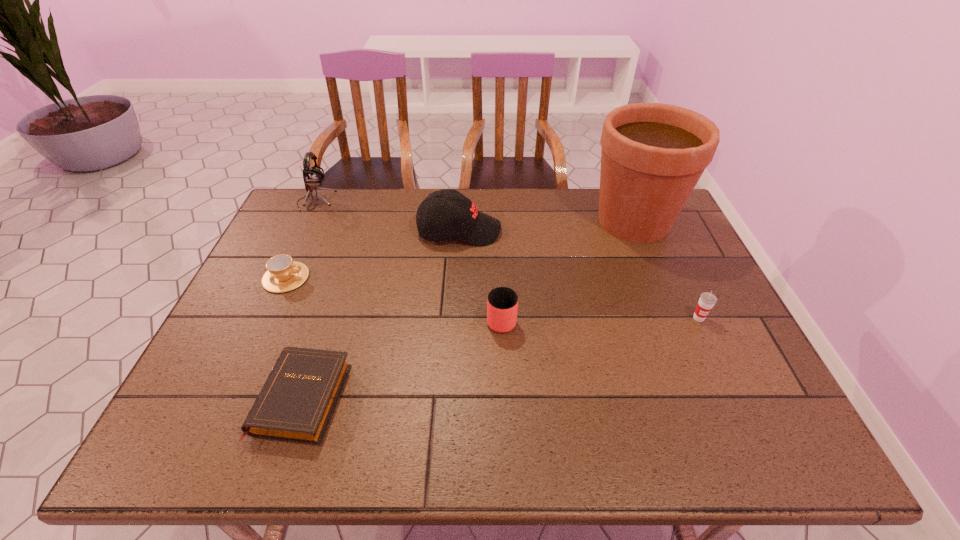
What are the coordinates of `free location at the left edge of the desktop` in the screenshot? It's located at (199, 406).

At what (x,y) coordinates should I click in order to perform the action: click on free space at the right edge of the desktop. Please return your answer as a coordinate pair (x, y). This screenshot has width=960, height=540. Looking at the image, I should click on (662, 279).

This screenshot has height=540, width=960. Find the location of `free space at the far left corner of the desktop`. free space at the far left corner of the desktop is located at coordinates (299, 214).

The image size is (960, 540). Identify the location of free space between the baseball cap and the second cup from left to right. (480, 274).

The width and height of the screenshot is (960, 540). Find the location of `vacant point located between the second cup from left to right and the farthest cup`. vacant point located between the second cup from left to right and the farthest cup is located at coordinates (394, 298).

I want to click on free spot between the second cup from left to right and the fifth object from right to left, so click(402, 359).

You are a GUI agent. You are given a task and a screenshot of the screen. Output one action in this format:
    pyautogui.click(x=<x>, y=<y>)
    Task: Click on the free space between the second cup from left to right and the earphone
    The height and width of the screenshot is (540, 960).
    Given the screenshot: What is the action you would take?
    pyautogui.click(x=409, y=260)

This screenshot has height=540, width=960. What are the coordinates of `empty location between the rightmost cup and the tallest object` in the screenshot? It's located at (666, 269).

The image size is (960, 540). Find the location of `unoccupied area between the shortest cup and the second cup from right to left`. unoccupied area between the shortest cup and the second cup from right to left is located at coordinates (394, 298).

The height and width of the screenshot is (540, 960). In order to click on vacant space that's between the second cup from right to left and the second tallest object in this screenshot , I will do `click(409, 260)`.